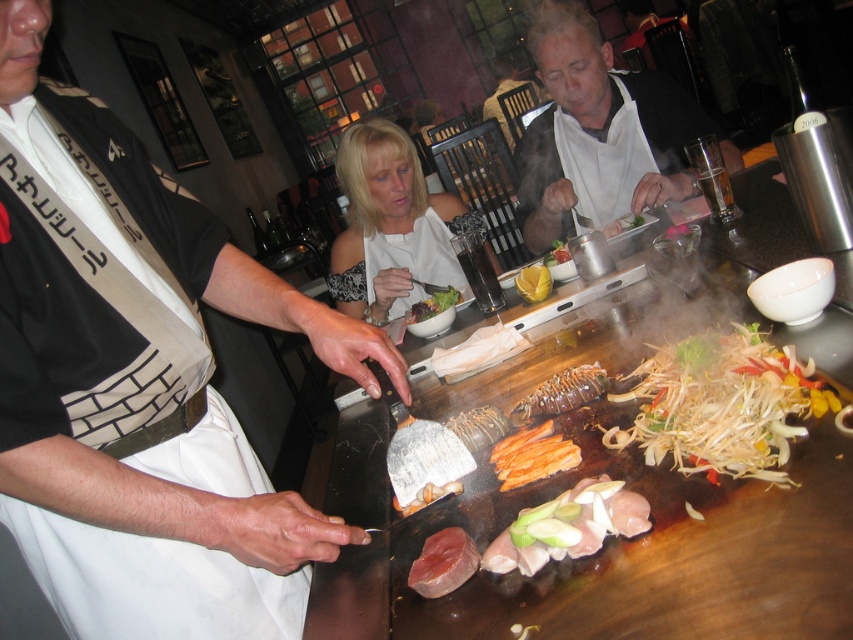
Is point (572, 314) farther from viewer compared to point (712, 419)?

Yes, point (572, 314) is behind point (712, 419).

Who is more distant from viewer, (788, 209) or (762, 387)?

Point (788, 209)

Who is more distant from viewer, (381, 556) or (798, 365)?

The point (381, 556) is behind.

Where is `wooden table at center`? This screenshot has width=853, height=640. wooden table at center is located at coordinates (601, 548).

Between point (438, 492) and point (567, 260), which one is positioned behind?

The point (567, 260) is behind.

Consider the image. Who is lower down, smooth pinkish meat at center or smooth white plate at center?

smooth pinkish meat at center

Where is `smooth pinkish meat at center`? smooth pinkish meat at center is located at coordinates (428, 497).

Identify the location of smooth pinkish meat at center. This screenshot has height=640, width=853. (428, 497).

Who is taller, white glossy sliced onions at center or yellow lemon at center?

With more height is white glossy sliced onions at center.

Can you confirm if white glossy sliced onions at center is positioned below yellow lemon at center?

Correct, white glossy sliced onions at center is located below yellow lemon at center.

At what (x,y) coordinates should I click in order to perform the action: click on white glossy sliced onions at center. Please return your answer as a coordinate pair (x, y). This screenshot has width=853, height=640. Looking at the image, I should click on (567, 525).